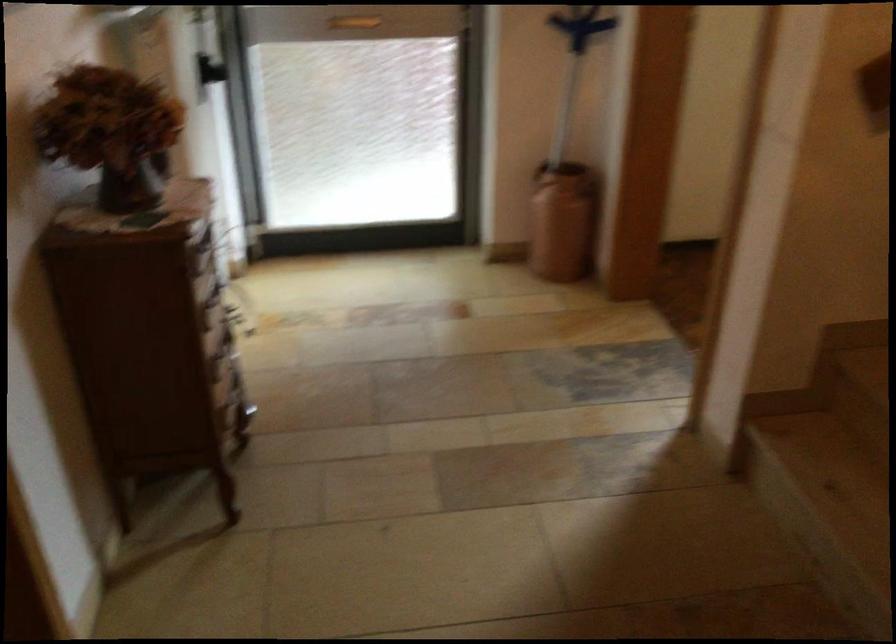
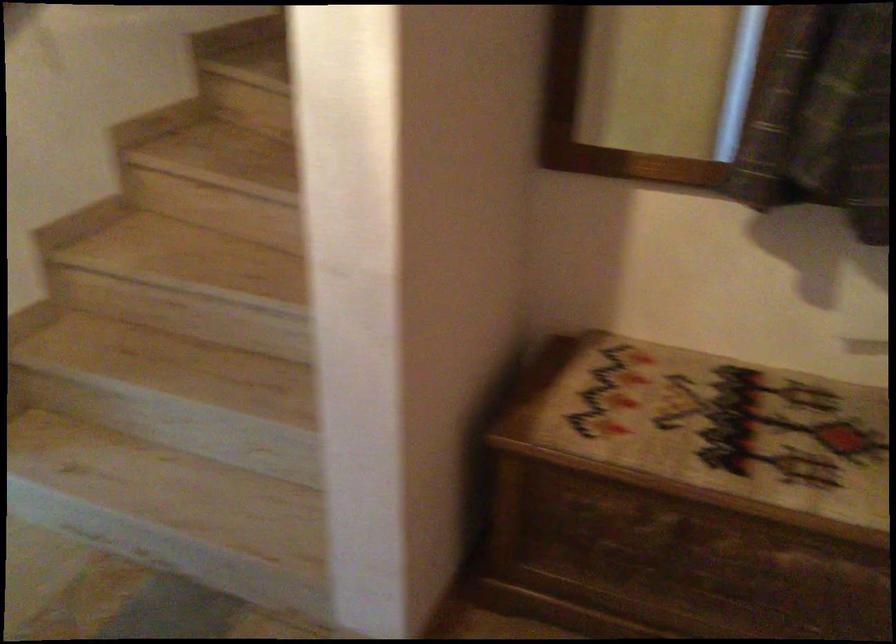
Question: The first image is from the beginning of the video and the second image is from the end. How did the camera likely rotate when shooting the video?

Choices:
 (A) Left
 (B) Right
 (C) Up
 (D) Down

Answer: (B)